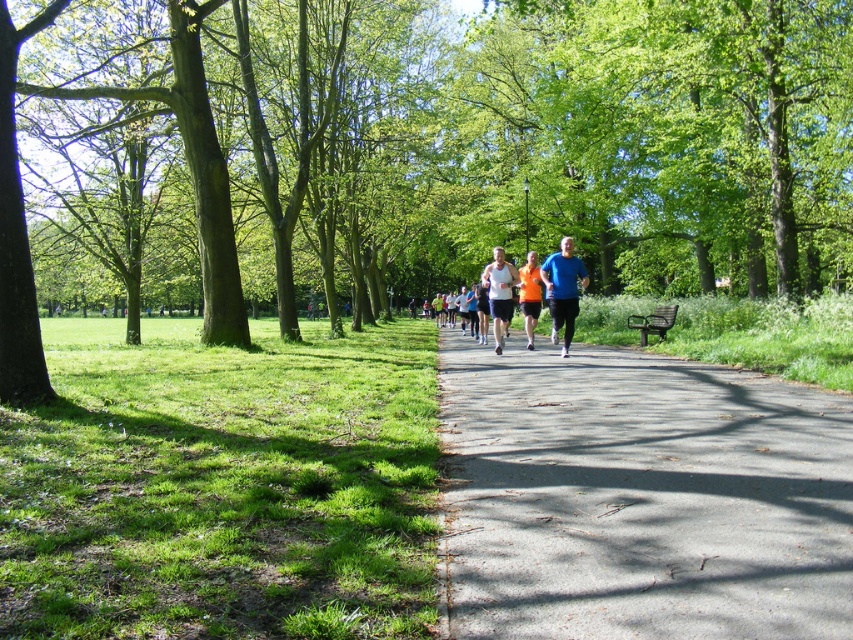
Which is below, green leafy tree at center or orange fabric shirt at center?

Positioned lower is orange fabric shirt at center.

Measure the distance between green leafy tree at center and orange fabric shirt at center.

They are 39.50 feet apart.

Does point (401, 113) come in front of point (541, 280)?

No, (401, 113) is behind (541, 280).

The width and height of the screenshot is (853, 640). Find the location of `green leafy tree at center`. green leafy tree at center is located at coordinates (442, 148).

Who is lower down, blue fabric shirt at center or matte white tank top at center?

blue fabric shirt at center

Who is more forward, (566, 253) or (490, 292)?

Point (566, 253) is more forward.

Locate an element on the screen. This screenshot has height=640, width=853. blue fabric shirt at center is located at coordinates (563, 289).

The image size is (853, 640). Identify the location of blue fabric shirt at center. (563, 289).

Is blue fabric shirt at center positioned at the back of orange fabric shirt at center?

No.

Image resolution: width=853 pixels, height=640 pixels. Describe the element at coordinates (563, 289) in the screenshot. I see `blue fabric shirt at center` at that location.

The width and height of the screenshot is (853, 640). I want to click on blue fabric shirt at center, so click(563, 289).